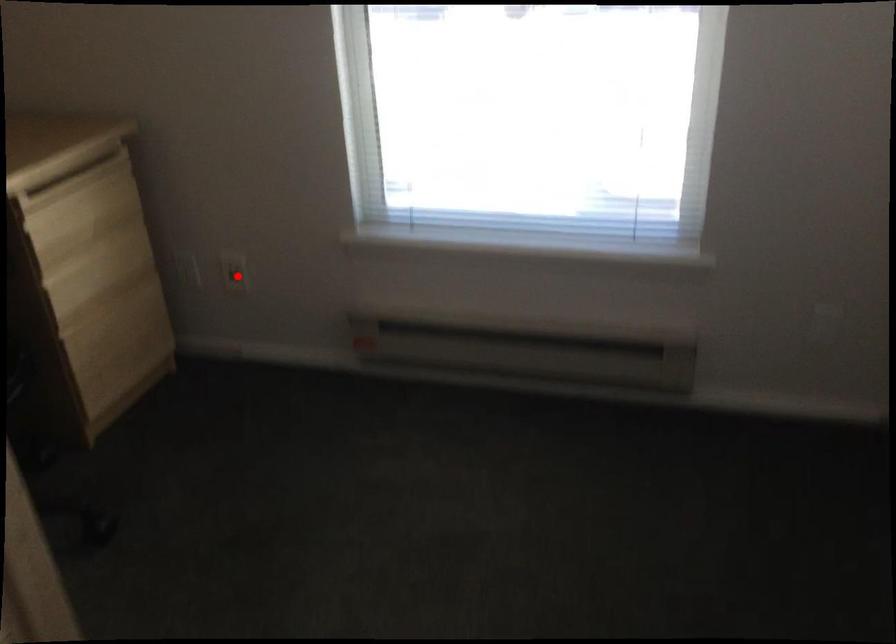
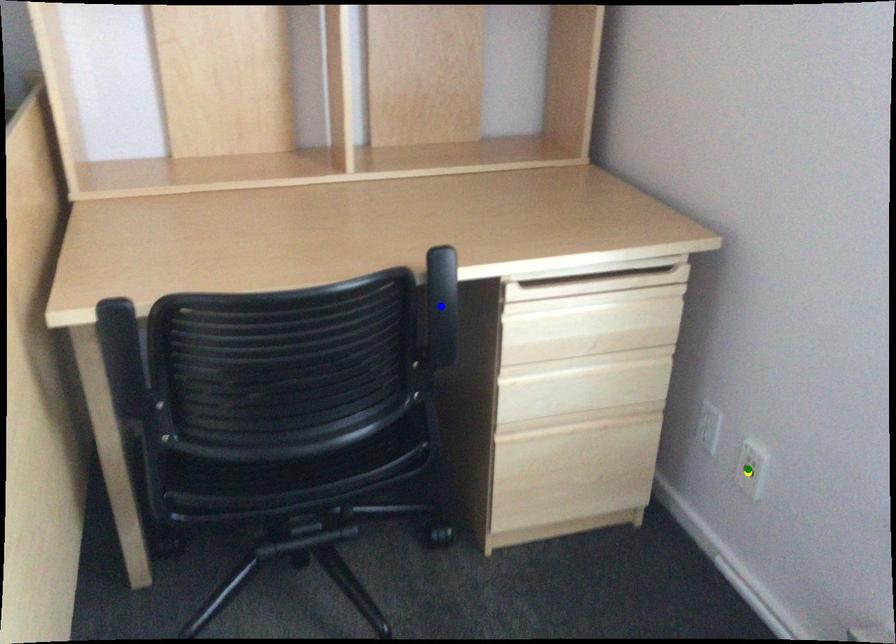
Question: I am providing you with two images of the same scene from different viewpoints. A red point is marked on the first image. You are given multiple points on the second image. Which point in image 2 is actually the same real-world point as the red point in image 1?

Choices:
 (A) yellow point
 (B) green point
 (C) blue point

Answer: (A)